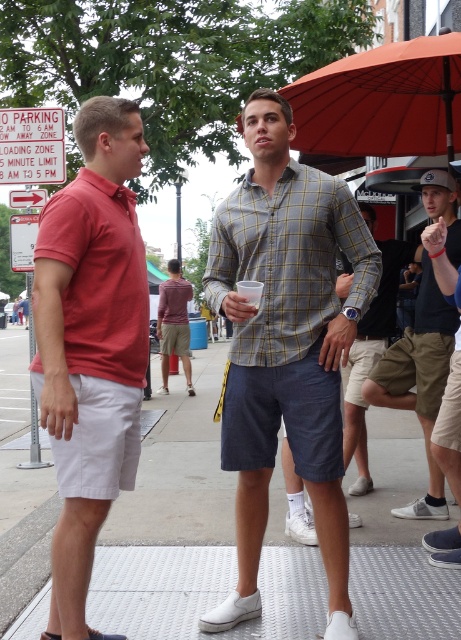
From the picture: You are a photographer trying to capture a candid shot of the matte red polo shirt at left and the khaki cotton shorts at lower right. Since you want to focus on both subjects, which one should you adjust your camera focus to prioritize based on their positions?

The matte red polo shirt at left is in front of the khaki cotton shorts at lower right, so you should prioritize focusing on the matte red polo shirt at left to ensure it is in sharp focus while the background subject may naturally blur.

You are a fashion designer analyzing the outfit of two people in the image. Which clothing item is taller, the matte red polo shirt at left or the khaki cotton shorts at lower right?

The matte red polo shirt at left is much taller than the khaki cotton shorts at lower right.